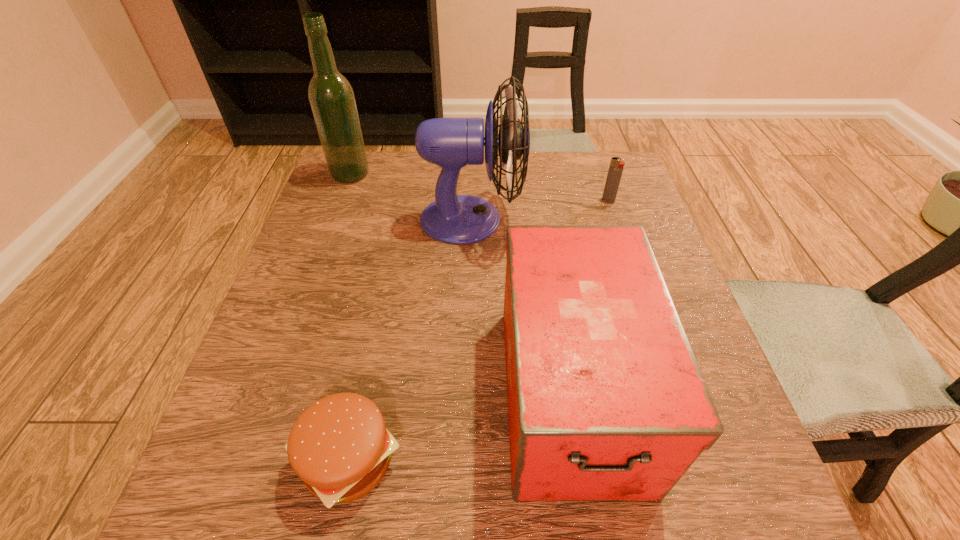
Where is `object positioned at the far left corner`? object positioned at the far left corner is located at coordinates (332, 100).

Identify the location of object present at the near left corner. (339, 446).

The image size is (960, 540). I want to click on object present at the far right corner, so click(616, 167).

The image size is (960, 540). Identify the location of object that is positioned at the near right corner. 606,401.

This screenshot has height=540, width=960. I want to click on vacant area at the far edge, so click(x=484, y=177).

You are a GUI agent. You are given a task and a screenshot of the screen. Output one action in this format:
    pyautogui.click(x=<x>, y=<y>)
    Task: Click on the vacant space at the left edge
    The height and width of the screenshot is (540, 960).
    Given the screenshot: What is the action you would take?
    pyautogui.click(x=288, y=327)

This screenshot has width=960, height=540. I want to click on vacant region at the right edge of the desktop, so click(595, 208).

Identify the location of vacant space at the far right corner. The height and width of the screenshot is (540, 960). (599, 172).

This screenshot has height=540, width=960. Identify the location of free spot between the fan and the hamburger. (410, 339).

Where is `empty location between the shortest object and the third shortest object`? Image resolution: width=960 pixels, height=540 pixels. empty location between the shortest object and the third shortest object is located at coordinates (460, 427).